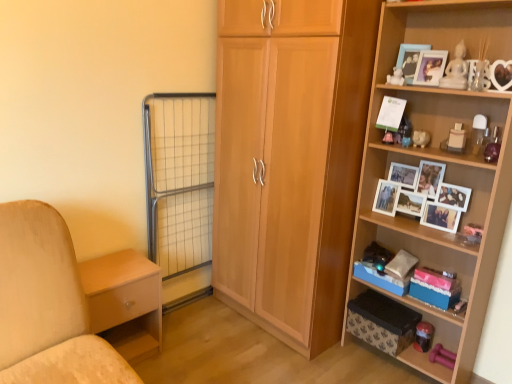
Question: Considering their positions, is white matte bear at upper right, positioned as the third toy in right-to-left order, located in front of or behind white matte piggy bank at upper right, acting as the second toy starting from the left?

Choices:
 (A) front
 (B) behind

Answer: (A)

Question: Considering the positions of white matte bear at upper right, acting as the second toy starting from the front, and white matte piggy bank at upper right, arranged as the 3th toy when viewed from the top, in the image, is white matte bear at upper right, acting as the second toy starting from the front, wider or thinner than white matte piggy bank at upper right, arranged as the 3th toy when viewed from the top,?

Choices:
 (A) thin
 (B) wide

Answer: (A)

Question: Considering the real-world distances, which object is farthest from the light wood/finely finished nightstand at lower left?

Choices:
 (A) light brown wood cupboard at center
 (B) pink fabric storage box at lower right, which is the second storage box from bottom to top
 (C) matte white photo frame at upper right, which is the first picture frame from right to left
 (D) wooden shelf at right, the 1th shelf ordered from the bottom
 (E) metal grid screen door at lower left

Answer: (C)

Question: Estimate the real-world distances between objects in this image. Which object is closer to the light brown wood cupboard at center?

Choices:
 (A) light wood/finely finished nightstand at lower left
 (B) blue cardboard storage box at lower right, the 1th storage box when ordered from top to bottom
 (C) patterned fabric storage box at lower right, the 3th storage box viewed from the top
 (D) wooden photo frame at upper right, the 1th picture frame when ordered from left to right
 (E) white matte bear at upper right, placed as the 2th toy when sorted from back to front

Answer: (C)